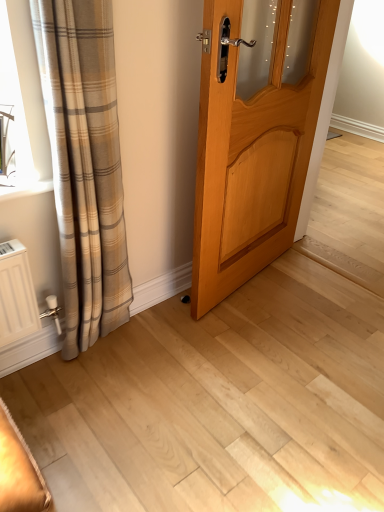
The width and height of the screenshot is (384, 512). In order to click on light wood door at center in this screenshot , I will do `click(252, 155)`.

What do you see at coordinates (252, 155) in the screenshot? I see `light wood door at center` at bounding box center [252, 155].

The image size is (384, 512). Describe the element at coordinates (85, 164) in the screenshot. I see `plaid fabric curtain at left` at that location.

Find the location of a particular element. Image resolution: width=384 pixels, height=512 pixels. plaid fabric curtain at left is located at coordinates (85, 164).

Based on the photo, measure the distance between plaid fabric curtain at left and camera.

plaid fabric curtain at left is 94.32 centimeters away from camera.

Find the location of `light wood door at center`. light wood door at center is located at coordinates (252, 155).

Which object is positioned more to the right, plaid fabric curtain at left or light wood door at center?

light wood door at center is more to the right.

Who is more distant, plaid fabric curtain at left or light wood door at center?

light wood door at center is behind.

Does point (111, 227) appear closer or farther from the camera than point (241, 240)?

Clearly, point (111, 227) is closer to the camera than point (241, 240).

From the image's perspective, between plaid fabric curtain at left and light wood door at center, who is located below?

From the image's view, plaid fabric curtain at left is below.

From a real-world perspective, is plaid fabric curtain at left beneath light wood door at center?

Yes, from a real-world perspective, plaid fabric curtain at left is under light wood door at center.

Between plaid fabric curtain at left and light wood door at center, which one has larger width?

plaid fabric curtain at left is wider.

Is plaid fabric curtain at left taller than light wood door at center?

Yes, plaid fabric curtain at left is taller than light wood door at center.

Can you confirm if plaid fabric curtain at left is bigger than light wood door at center?

Incorrect, plaid fabric curtain at left is not larger than light wood door at center.

Based on the photo, is plaid fabric curtain at left not inside light wood door at center?

Yes, plaid fabric curtain at left is located beyond the bounds of light wood door at center.

Is plaid fabric curtain at left not close to light wood door at center?

Actually, plaid fabric curtain at left and light wood door at center are a little close together.

Is plaid fabric curtain at left facing away from light wood door at center?

No, light wood door at center is not at the back of plaid fabric curtain at left.

Measure the distance between plaid fabric curtain at left and light wood door at center.

plaid fabric curtain at left and light wood door at center are 51.41 centimeters apart from each other.

Image resolution: width=384 pixels, height=512 pixels. Identify the location of door above the plaid fabric curtain at left (from the image's perspective). (252, 155).

Does light wood door at center appear on the right side of plaid fabric curtain at left?

Correct, you'll find light wood door at center to the right of plaid fabric curtain at left.

Which object is further away from the camera, light wood door at center or plaid fabric curtain at left?

light wood door at center.

Considering the positions of points (252, 214) and (56, 89), is point (252, 214) farther from camera compared to point (56, 89)?

Yes, it is.

From the image's perspective, is light wood door at center located above or below plaid fabric curtain at left?

light wood door at center is above plaid fabric curtain at left.

From a real-world perspective, is light wood door at center physically above plaid fabric curtain at left?

Yes, from a real-world perspective, light wood door at center is on top of plaid fabric curtain at left.

Which object is wider, light wood door at center or plaid fabric curtain at left?

plaid fabric curtain at left is wider.

Can you confirm if light wood door at center is shorter than plaid fabric curtain at left?

Correct, light wood door at center is not as tall as plaid fabric curtain at left.

Which of these two, light wood door at center or plaid fabric curtain at left, is bigger?

light wood door at center is bigger.

Do you think light wood door at center is within plaid fabric curtain at left, or outside of it?

The correct answer is: outside.

Is light wood door at center far away from plaid fabric curtain at left?

Actually, light wood door at center and plaid fabric curtain at left are a little close together.

Is light wood door at center oriented away from plaid fabric curtain at left?

light wood door at center is not turned away from plaid fabric curtain at left.

From the picture: What's the angular difference between light wood door at center and plaid fabric curtain at left's facing directions?

The angular difference between light wood door at center and plaid fabric curtain at left is 10.8 degrees.

The width and height of the screenshot is (384, 512). Find the location of `door located above the plaid fabric curtain at left (from the image's perspective)`. door located above the plaid fabric curtain at left (from the image's perspective) is located at coordinates (252, 155).

You are a GUI agent. You are given a task and a screenshot of the screen. Output one action in this format:
    pyautogui.click(x=<x>, y=<y>)
    Task: Click on the door above the plaid fabric curtain at left (from the image's perspective)
    The image size is (384, 512).
    Given the screenshot: What is the action you would take?
    pyautogui.click(x=252, y=155)

Where is `door that is above the plaid fabric curtain at left (from a real-world perspective)`? This screenshot has width=384, height=512. door that is above the plaid fabric curtain at left (from a real-world perspective) is located at coordinates 252,155.